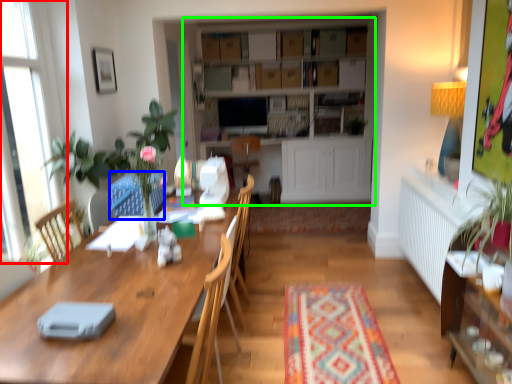
Question: Considering the real-world distances, which object is closest to window (highlighted by a red box)? swivel chair (highlighted by a blue box) or entertainment center (highlighted by a green box).

Choices:
 (A) swivel chair
 (B) entertainment center

Answer: (A)